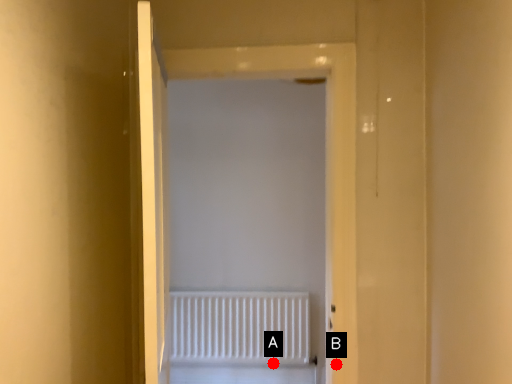
Question: Two points are circled on the image, labeled by A and B beside each circle. Which point is further to the camera?

Choices:
 (A) A is further
 (B) B is further

Answer: (A)